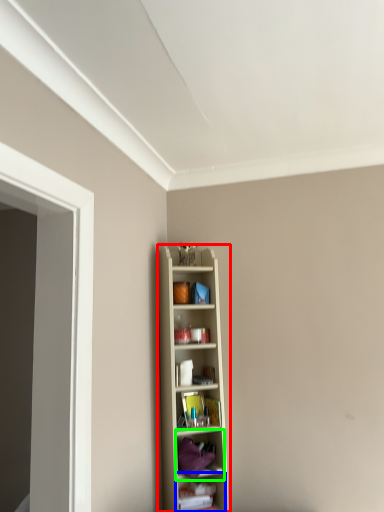
Question: Which object is positioned closest to shelf (highlighted by a red box)? Select from shelf (highlighted by a blue box) and shelf (highlighted by a green box).

Choices:
 (A) shelf
 (B) shelf

Answer: (B)